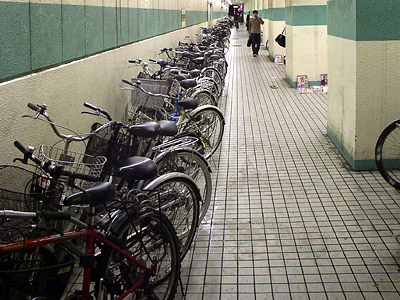
Where is `dirty white tile floor`? The height and width of the screenshot is (300, 400). dirty white tile floor is located at coordinates (276, 244).